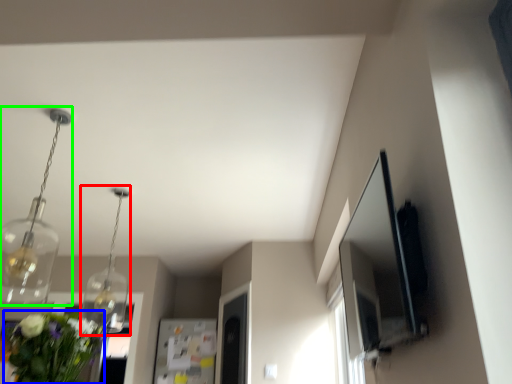
Question: Which object is the closest to the light fixture (highlighted by a red box)? Choose among these: floral arrangement (highlighted by a blue box) or light fixture (highlighted by a green box).

Choices:
 (A) floral arrangement
 (B) light fixture

Answer: (B)